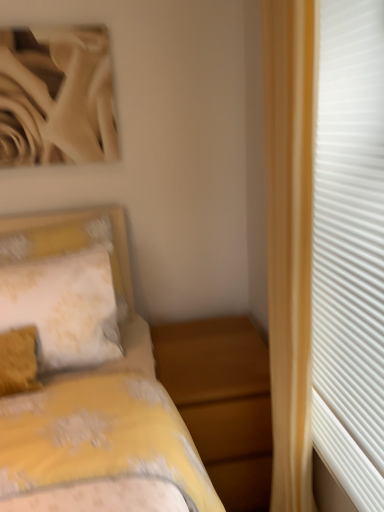
Question: Is white textured curtain at right taller or shorter than yellow floral fabric pillow at left?

Choices:
 (A) short
 (B) tall

Answer: (B)

Question: Is white textured curtain at right wider or thinner than yellow floral fabric pillow at left?

Choices:
 (A) wide
 (B) thin

Answer: (B)

Question: Which object is positioned farthest from the white textured curtain at right?

Choices:
 (A) yellow floral fabric pillow at left
 (B) matte wood nightstand at lower center

Answer: (A)

Question: Which is farther from the matte wood nightstand at lower center?

Choices:
 (A) yellow floral fabric pillow at left
 (B) white textured curtain at right

Answer: (B)